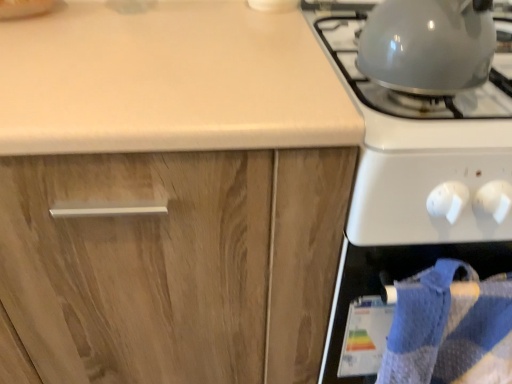
Question: Does glossy white gas stove at right, the 2th gas stove from the left, have a larger size compared to shiny metallic kettle at upper right, which is the first gas stove in left-to-right order?

Choices:
 (A) no
 (B) yes

Answer: (B)

Question: Can you confirm if glossy white gas stove at right, which is the first gas stove from right to left, is thinner than shiny metallic kettle at upper right, acting as the 2th gas stove starting from the right?

Choices:
 (A) no
 (B) yes

Answer: (A)

Question: Is glossy white gas stove at right, the 2th gas stove from the left, completely or partially outside of shiny metallic kettle at upper right, which is the first gas stove in left-to-right order?

Choices:
 (A) yes
 (B) no

Answer: (A)

Question: Is shiny metallic kettle at upper right, which is the first gas stove in left-to-right order, inside glossy white gas stove at right, which is the first gas stove from right to left?

Choices:
 (A) no
 (B) yes

Answer: (B)

Question: Does glossy white gas stove at right, which is the first gas stove from right to left, have a lesser height compared to shiny metallic kettle at upper right, acting as the 2th gas stove starting from the right?

Choices:
 (A) yes
 (B) no

Answer: (B)

Question: Is blue textured towel at lower right situated inside shiny metallic kettle at upper right, acting as the 2th gas stove starting from the right, or outside?

Choices:
 (A) outside
 (B) inside

Answer: (A)

Question: Is blue textured towel at lower right in front of or behind shiny metallic kettle at upper right, acting as the 2th gas stove starting from the right, in the image?

Choices:
 (A) front
 (B) behind

Answer: (B)

Question: Does point (428, 249) appear closer or farther from the camera than point (496, 86)?

Choices:
 (A) closer
 (B) farther

Answer: (A)

Question: Would you say blue textured towel at lower right is to the left or to the right of shiny metallic kettle at upper right, acting as the 2th gas stove starting from the right, in the picture?

Choices:
 (A) right
 (B) left

Answer: (A)

Question: In terms of width, does shiny metallic kettle at upper right, which is the first gas stove in left-to-right order, look wider or thinner when compared to wooden cabinet at center?

Choices:
 (A) wide
 (B) thin

Answer: (B)

Question: Does point (331, 36) appear closer or farther from the camera than point (104, 296)?

Choices:
 (A) farther
 (B) closer

Answer: (A)

Question: Would you say shiny metallic kettle at upper right, acting as the 2th gas stove starting from the right, is inside or outside wooden cabinet at center?

Choices:
 (A) outside
 (B) inside

Answer: (A)

Question: Would you say shiny metallic kettle at upper right, acting as the 2th gas stove starting from the right, is to the left or to the right of wooden cabinet at center in the picture?

Choices:
 (A) left
 (B) right

Answer: (B)

Question: From a real-world perspective, is wooden cabinet at center above or below blue textured towel at lower right?

Choices:
 (A) above
 (B) below

Answer: (B)

Question: From the image's perspective, is wooden cabinet at center positioned above or below blue textured towel at lower right?

Choices:
 (A) above
 (B) below

Answer: (A)